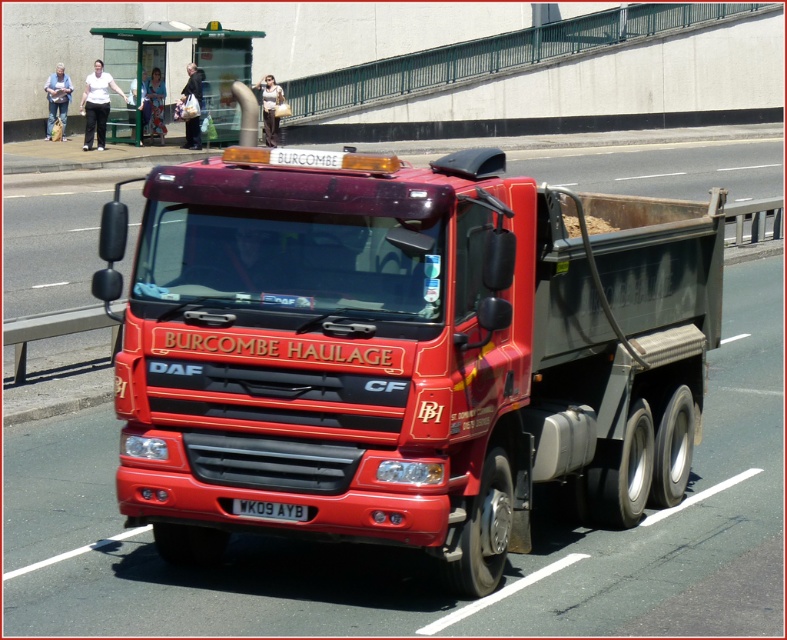
You are a photographer wanting to capture the entire matte red truck at center and the black plastic license plate at center in a single photo. Considering their heights, which object should you focus on to ensure both are in frame?

The matte red truck at center is taller than the black plastic license plate at center. To ensure both are in frame, focus on the matte red truck at center as it is the taller object, allowing the license plate to be captured below it.

You are standing at the origin point of a coordinate system. There is a matte red truck at center represented by point [405,353]. Can you determine the direction of the truck relative to your position?

The matte red truck at center is located at coordinates [405,353], which is northeast of the origin point. Therefore, the truck is northeast of your position.

Consider the image. You are standing in front of the red DAF CF CF180 tipper truck from Burcombe Haulage. You notice two points on the truck. The first point is at coordinate (490, 211) and the second point is at coordinate (285, 509). Which of these two points is closer to you?

Point (490, 211) is closer to you because it is further to the viewer than point (285, 509).